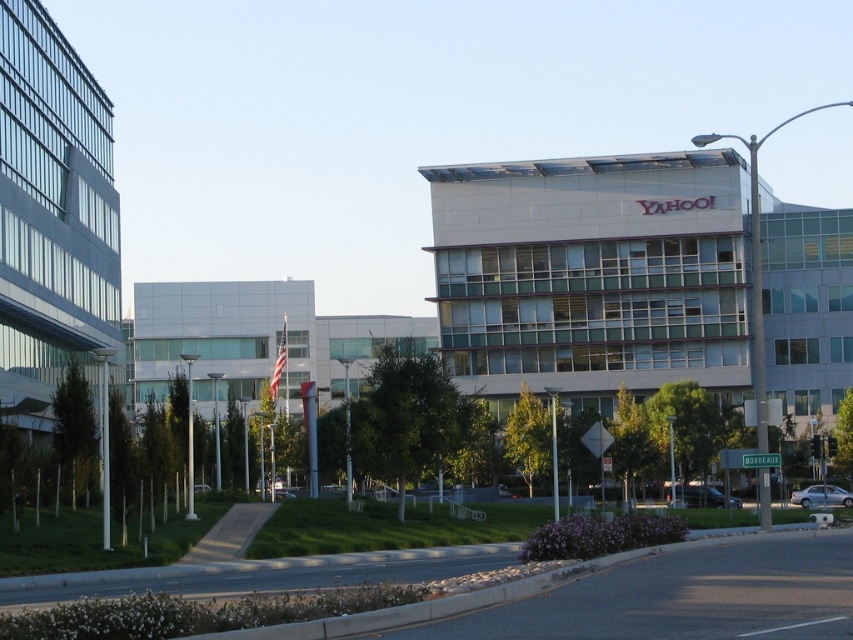
Question: Can you confirm if dark gray metallic van at center is thinner than silver metallic sedan at lower right?

Choices:
 (A) yes
 (B) no

Answer: (B)

Question: In this image, where is dark gray metallic van at center located relative to silver metallic sedan at lower right?

Choices:
 (A) below
 (B) above

Answer: (B)

Question: Does dark gray metallic van at center appear over silver metallic sedan at lower right?

Choices:
 (A) yes
 (B) no

Answer: (A)

Question: Among these points, which one is nearest to the camera?

Choices:
 (A) (837, 490)
 (B) (728, 499)

Answer: (B)

Question: Which point is farther from the camera taking this photo?

Choices:
 (A) (730, 500)
 (B) (793, 492)

Answer: (B)